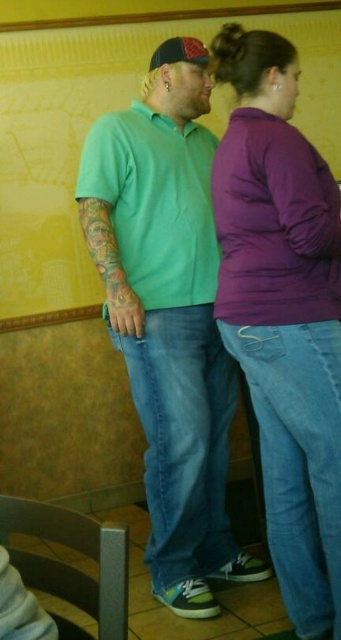
You are a photographer setting up a shoot in this scene. You need to ensure that the purple fleece at center and the matte black baseball cap at upper center are both visible in the frame. Based on their positions, which object should you focus on first to capture both in the shot?

The purple fleece at center is positioned under the matte black baseball cap at upper center, so focusing on the matte black baseball cap at upper center first would allow both objects to be captured in the frame since the fleece is below it.